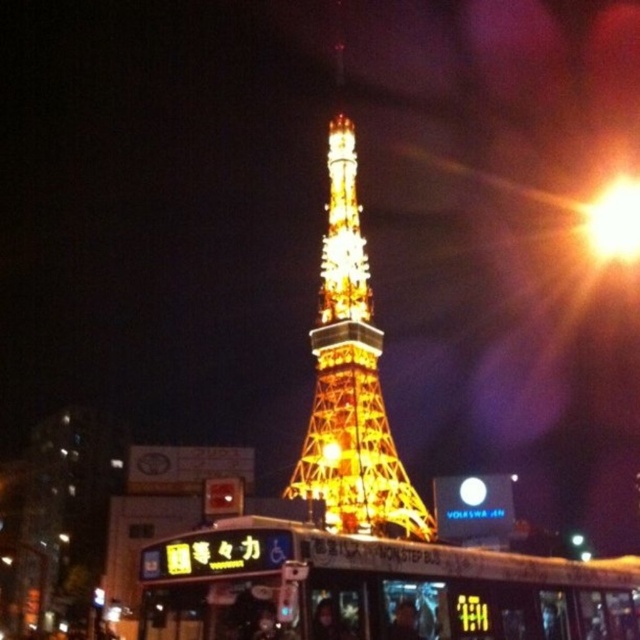
Question: Which object appears farthest from the camera in this image?

Choices:
 (A) metallic gold tower at center
 (B) metallic gold bus at center
 (C) gold metallic tower at center

Answer: (A)

Question: Among these points, which one is farthest from the camera?

Choices:
 (A) (381, 413)
 (B) (321, 449)
 (C) (330, 547)
 (D) (632, 179)

Answer: (D)

Question: Does bright yellow light at upper right lie behind metallic gold tower at center?

Choices:
 (A) yes
 (B) no

Answer: (A)

Question: Which point is farther from the camera taking this photo?

Choices:
 (A) (368, 353)
 (B) (333, 461)

Answer: (A)

Question: Can you confirm if metallic gold bus at center is positioned above gold metallic tower at center?

Choices:
 (A) yes
 (B) no

Answer: (B)

Question: From the image, what is the correct spatial relationship of metallic gold bus at center in relation to metallic gold tower at center?

Choices:
 (A) right
 (B) left

Answer: (A)